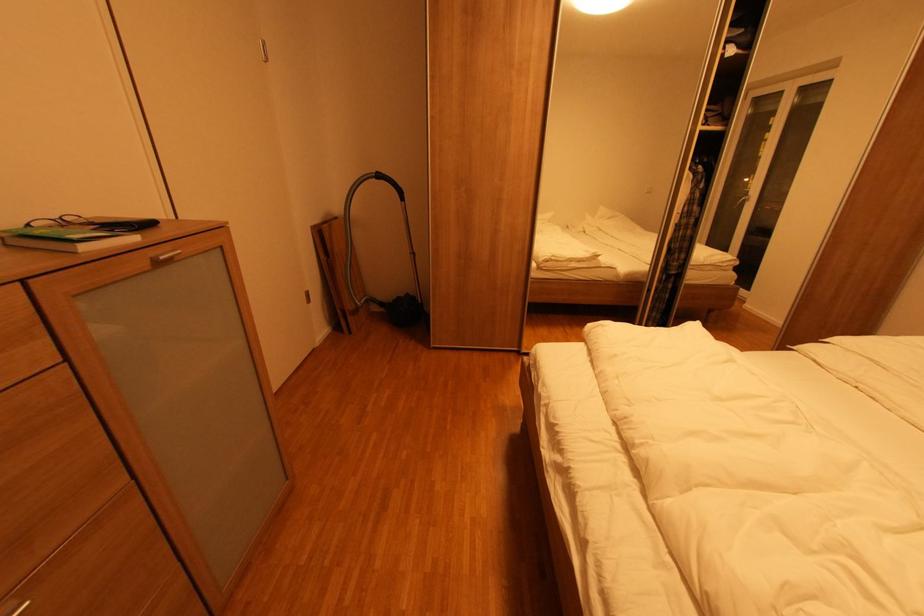
The image size is (924, 616). Identify the location of vacuum cleaner handle. (388, 183).